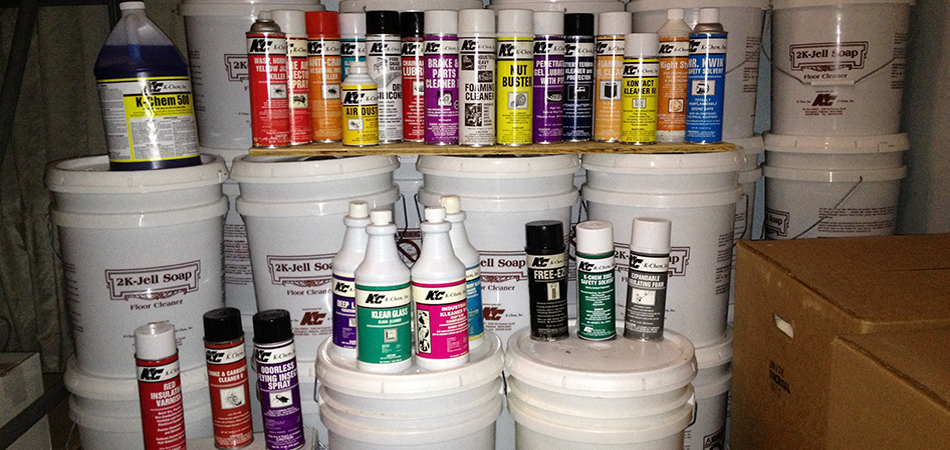
Identify the location of curtain. 39,274.